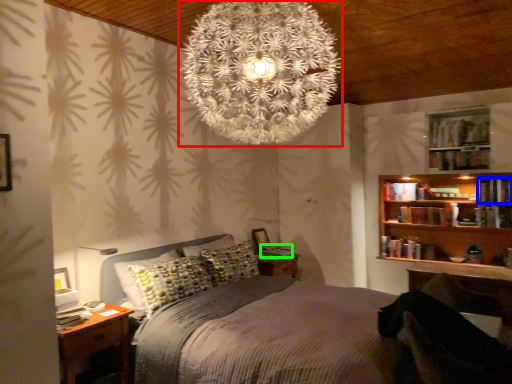
Question: Estimate the real-world distances between objects in this image. Which object is closer to christmas light (highlighted by a red box), book (highlighted by a blue box) or book (highlighted by a green box)?

Choices:
 (A) book
 (B) book

Answer: (B)